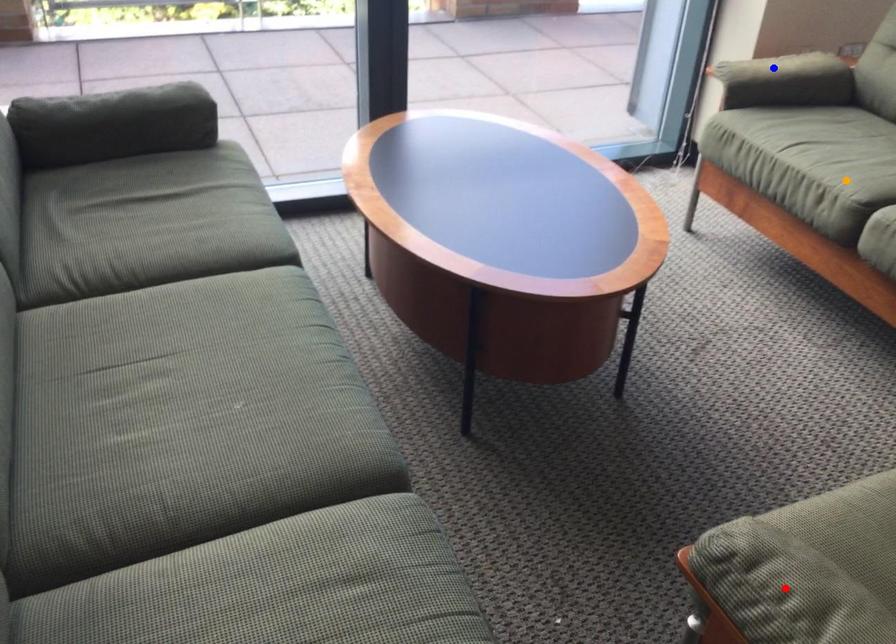
Order these from nearest to farthest:
orange point | red point | blue point

blue point
orange point
red point